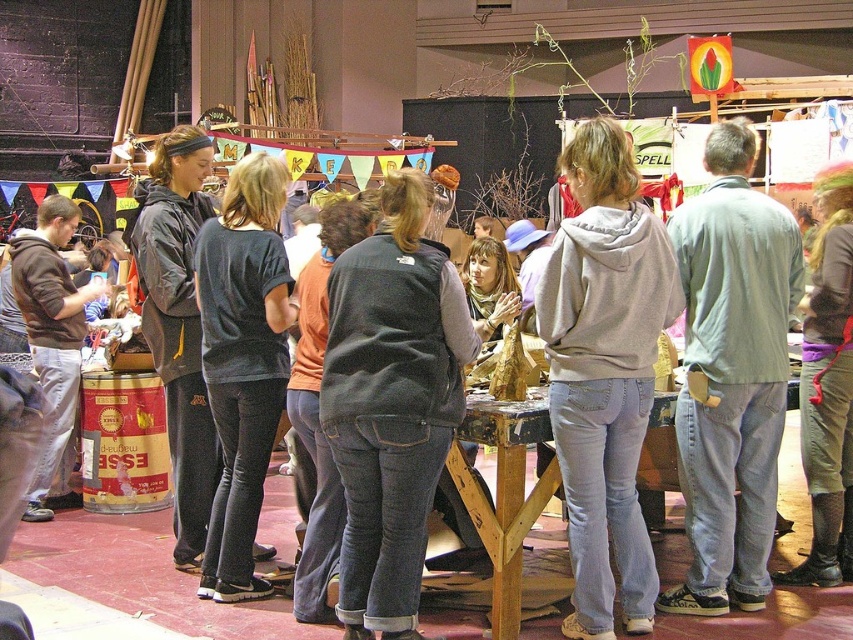
Question: Which of the following is the farthest from the observer?

Choices:
 (A) dark gray sweater at center
 (B) brown hoodie at left
 (C) light gray hoodie at center

Answer: (B)

Question: Can you confirm if greenish-gray fabric pants at center-right is wider than brown hoodie at left?

Choices:
 (A) yes
 (B) no

Answer: (A)

Question: Can you confirm if greenish-gray fabric pants at center-right is positioned to the right of brown hoodie at left?

Choices:
 (A) no
 (B) yes

Answer: (B)

Question: Among these points, which one is farthest from the camera?

Choices:
 (A) (639, 243)
 (B) (386, 444)
 (C) (730, 564)
 (D) (32, 310)

Answer: (D)

Question: Which object appears closest to the camera in this image?

Choices:
 (A) dark gray fleece vest at center
 (B) light gray shirt at center
 (C) greenish-gray fabric pants at center-right

Answer: (A)

Question: Can you confirm if light gray shirt at center is smaller than greenish-gray fabric pants at center-right?

Choices:
 (A) no
 (B) yes

Answer: (B)